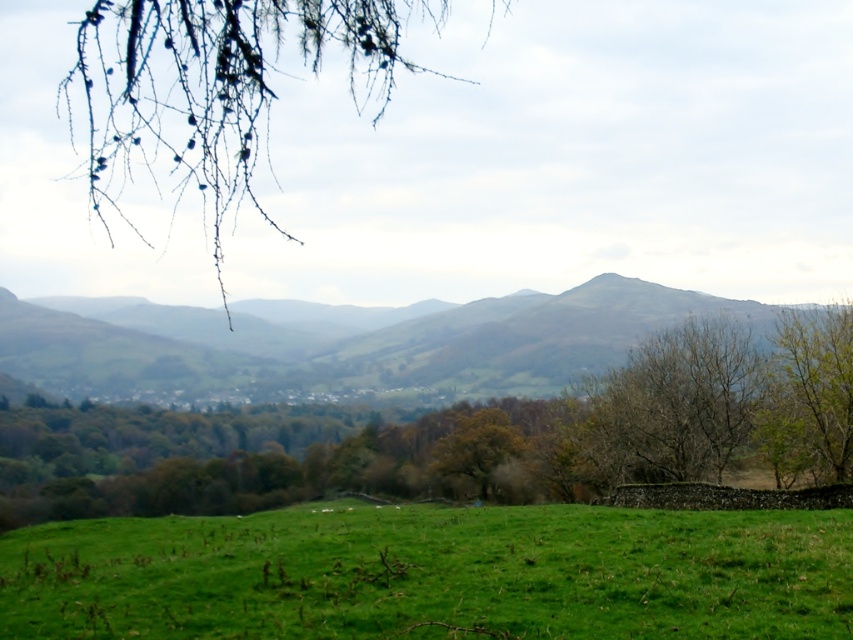
Question: Considering the relative positions of green grassy field at lower center and bare branches at center in the image provided, where is green grassy field at lower center located with respect to bare branches at center?

Choices:
 (A) above
 (B) below

Answer: (B)

Question: Considering the real-world distances, which object is closest to the green grassy field at lower center?

Choices:
 (A) green leafy tree at center
 (B) green grassy hill at center
 (C) green leafy tree at right

Answer: (C)

Question: Can you confirm if green leafy tree at center is thinner than green grassy field at lower center?

Choices:
 (A) yes
 (B) no

Answer: (B)

Question: Can you confirm if green leafy branch at upper left is positioned to the right of bare branches at center?

Choices:
 (A) no
 (B) yes

Answer: (A)

Question: Which point is farther from the camera taking this photo?

Choices:
 (A) (236, 472)
 (B) (289, 541)
 (C) (834, 355)
 (D) (405, 385)

Answer: (D)

Question: Which object is farther from the camera taking this photo?

Choices:
 (A) green grassy field at lower center
 (B) bare branches at center
 (C) green leafy tree at center
 (D) green leafy branch at upper left

Answer: (B)